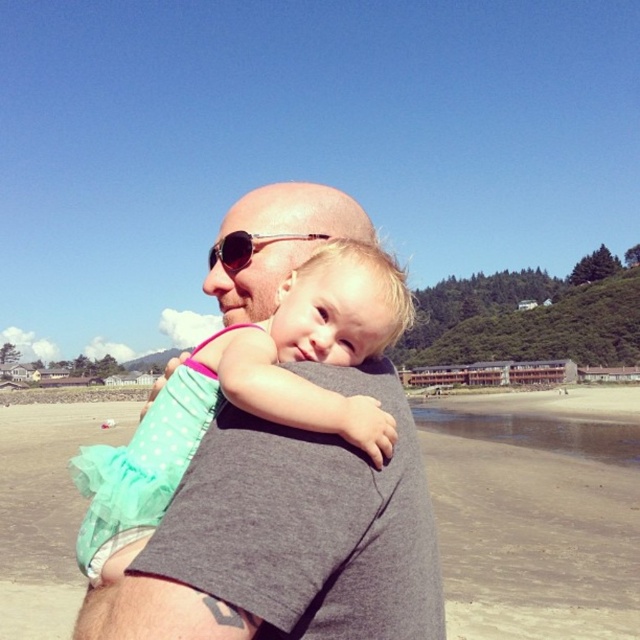
Can you confirm if gray cotton shirt at center is bigger than metallic gold sunglasses at center?

Indeed, gray cotton shirt at center has a larger size compared to metallic gold sunglasses at center.

Is gray cotton shirt at center to the left of metallic gold sunglasses at center from the viewer's perspective?

Yes, gray cotton shirt at center is to the left of metallic gold sunglasses at center.

In the scene shown: Who is more distant from viewer, (221, 497) or (292, 236)?

The point (292, 236) is more distant.

I want to click on gray cotton shirt at center, so click(x=285, y=538).

Which is behind, point (216, 525) or point (442, 444)?

The point (442, 444) is more distant.

Which is more to the left, gray cotton shirt at center or smooth sand at center?

gray cotton shirt at center is more to the left.

Which is in front, point (241, 280) or point (540, 424)?

Point (241, 280) is more forward.

Image resolution: width=640 pixels, height=640 pixels. What are the coordinates of `gray cotton shirt at center` in the screenshot? It's located at (285, 538).

Is smooth sand at center in front of metallic gold sunglasses at center?

That is False.

The image size is (640, 640). In order to click on smooth sand at center in this screenshot , I will do `click(536, 513)`.